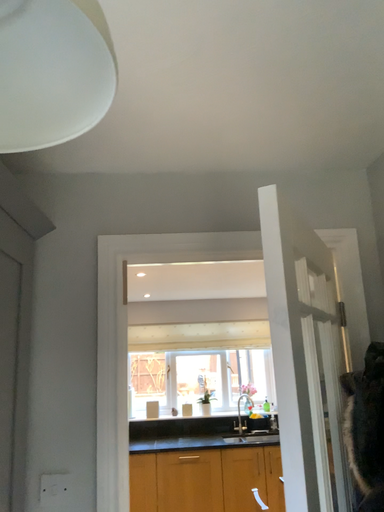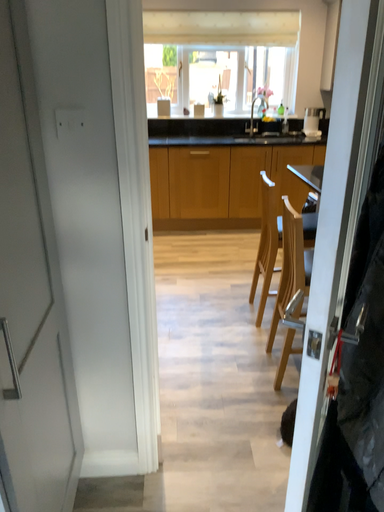
Question: How did the camera likely rotate when shooting the video?

Choices:
 (A) rotated upward
 (B) rotated downward

Answer: (B)